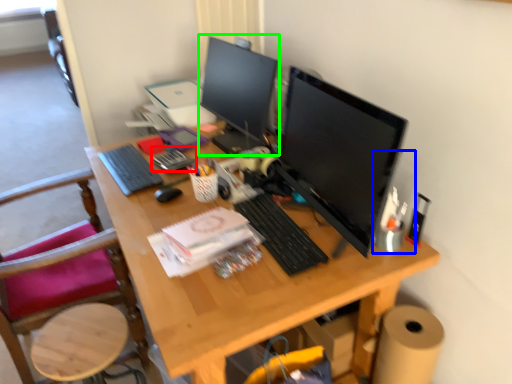
Question: Which object is positioned closest to stationery (highlighted by a red box)? Select from computer tower (highlighted by a blue box) and computer monitor (highlighted by a green box).

Choices:
 (A) computer tower
 (B) computer monitor

Answer: (B)